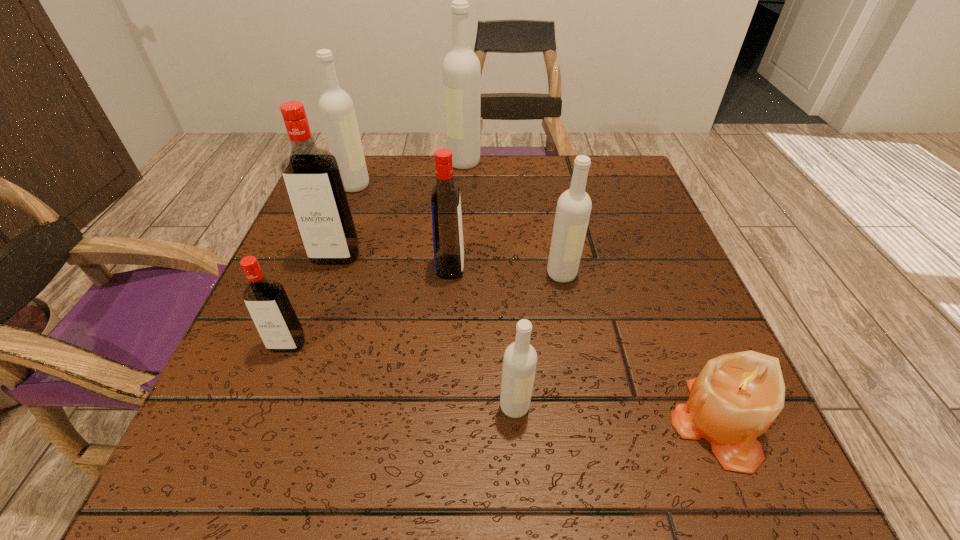
Find the location of a particular element. The image size is (960, 540). vacant area in the image that satisfies the following two spatial constraints: 1. on the front side of the shortest object; 2. on the right side of the third nearest white vodka is located at coordinates click(x=266, y=422).

Identify the location of vacant space that satisfies the following two spatial constraints: 1. on the front side of the smallest white vodka; 2. on the left side of the tallest object. This screenshot has height=540, width=960. (451, 406).

Where is `free space that satisfies the following two spatial constraints: 1. on the front and back of the third white vodka from left to right; 2. on the left side of the biggest red vodka`? free space that satisfies the following two spatial constraints: 1. on the front and back of the third white vodka from left to right; 2. on the left side of the biggest red vodka is located at coordinates (282, 406).

Locate an element on the screen. free space that satisfies the following two spatial constraints: 1. on the front and back of the rightmost red vodka; 2. on the right side of the shortest object is located at coordinates (439, 422).